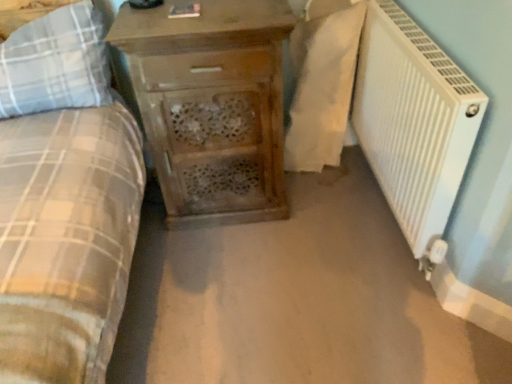
Where is `vacant space in front of wooden chest of drawers at center`? vacant space in front of wooden chest of drawers at center is located at coordinates (231, 276).